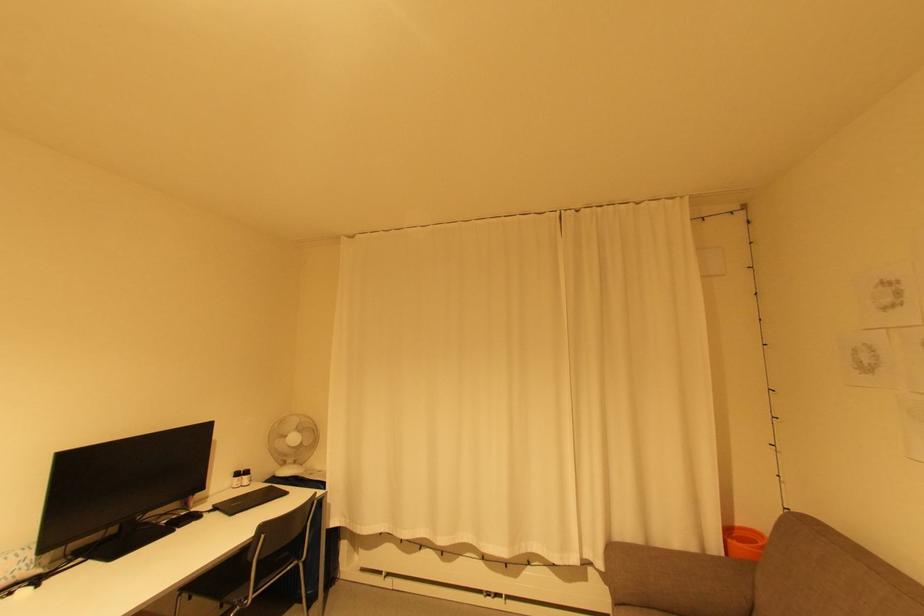
What are the coordinates of `orange bucket` in the screenshot? It's located at point(743,541).